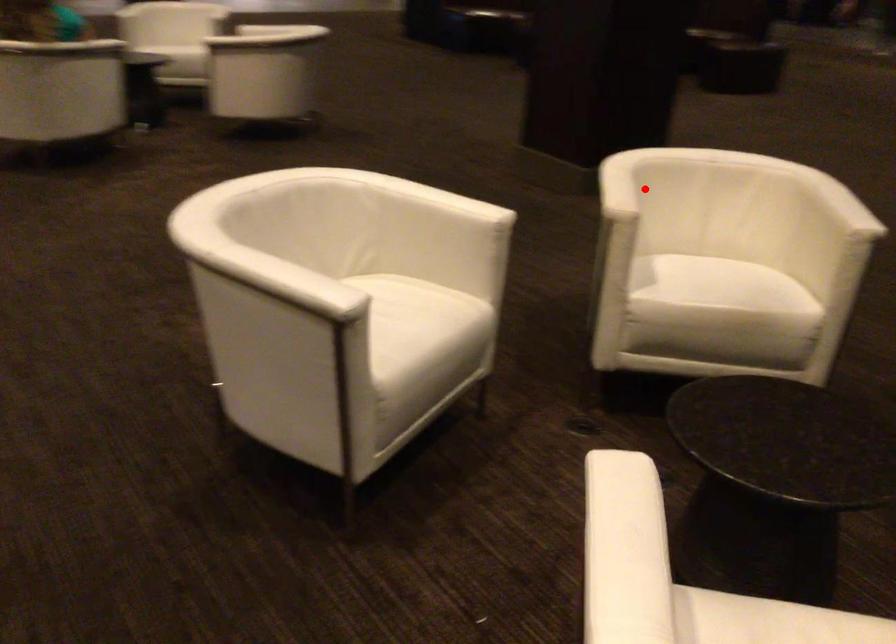
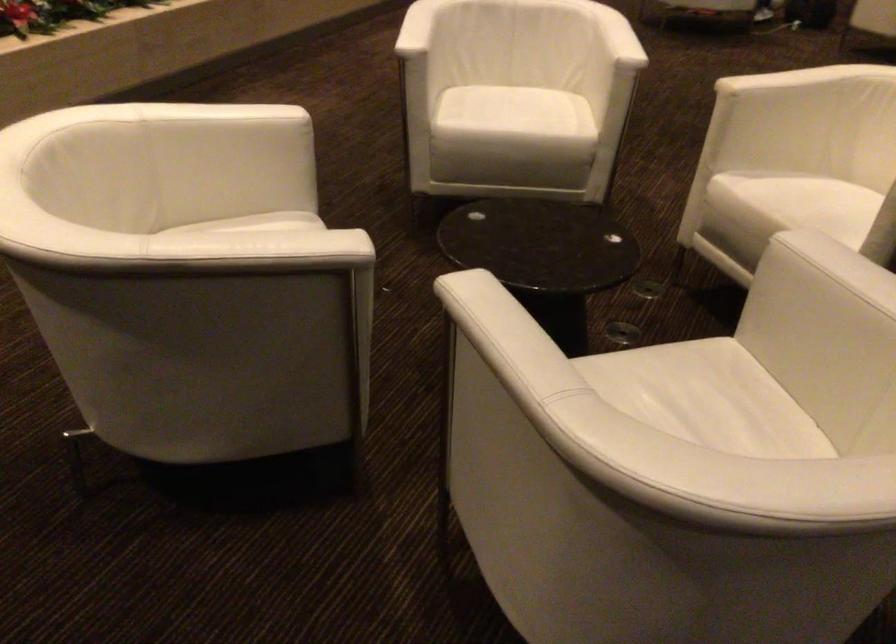
Locate, in the second image, the point that corresponds to the highlighted location in the first image.

(789, 80)